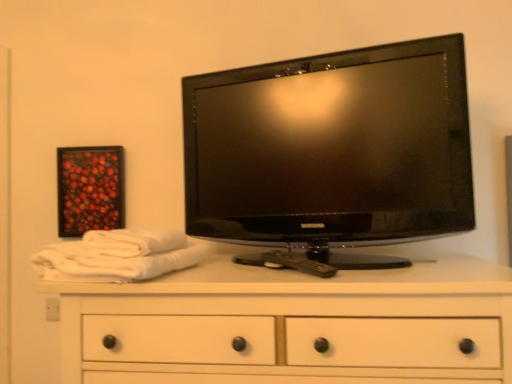
Question: Can we say white cotton bath towel at left, which is counted as the 2th bath towel, starting from the bottom, lies outside wooden framed artwork at upper left?

Choices:
 (A) yes
 (B) no

Answer: (A)

Question: Can you confirm if white cotton bath towel at left, which is counted as the 2th bath towel, starting from the bottom, is bigger than wooden framed artwork at upper left?

Choices:
 (A) no
 (B) yes

Answer: (B)

Question: Is white cotton bath towel at left, which is the first bath towel from top to bottom, aimed at wooden framed artwork at upper left?

Choices:
 (A) no
 (B) yes

Answer: (A)

Question: Can you confirm if white cotton bath towel at left, which is counted as the 2th bath towel, starting from the bottom, is positioned to the left of wooden framed artwork at upper left?

Choices:
 (A) yes
 (B) no

Answer: (B)

Question: Are white cotton bath towel at left, which is counted as the 2th bath towel, starting from the bottom, and wooden framed artwork at upper left located far from each other?

Choices:
 (A) no
 (B) yes

Answer: (A)

Question: Is white wood chest of drawers at center in front of or behind white cotton bath towel at left, marked as the 2th bath towel in a top-to-bottom arrangement, in the image?

Choices:
 (A) behind
 (B) front

Answer: (B)

Question: Is white wood chest of drawers at center wider or thinner than white cotton bath towel at left, marked as the 2th bath towel in a top-to-bottom arrangement?

Choices:
 (A) wide
 (B) thin

Answer: (A)

Question: From the image's perspective, relative to white cotton bath towel at left, the 1th bath towel positioned from the bottom, is white wood chest of drawers at center above or below?

Choices:
 (A) above
 (B) below

Answer: (B)

Question: From a real-world perspective, is white wood chest of drawers at center physically located above or below white cotton bath towel at left, the 1th bath towel positioned from the bottom?

Choices:
 (A) below
 (B) above

Answer: (A)

Question: Is wooden framed artwork at upper left situated inside white cotton bath towel at left, the 1th bath towel positioned from the bottom, or outside?

Choices:
 (A) outside
 (B) inside

Answer: (A)

Question: From their relative heights in the image, would you say wooden framed artwork at upper left is taller or shorter than white cotton bath towel at left, the 1th bath towel positioned from the bottom?

Choices:
 (A) tall
 (B) short

Answer: (A)

Question: From the image's perspective, relative to white cotton bath towel at left, the 1th bath towel positioned from the bottom, is wooden framed artwork at upper left above or below?

Choices:
 (A) below
 (B) above

Answer: (B)

Question: Is point (99, 226) positioned closer to the camera than point (117, 236)?

Choices:
 (A) closer
 (B) farther

Answer: (B)

Question: Looking at their shapes, would you say wooden framed artwork at upper left is wider or thinner than black glossy tv at upper center?

Choices:
 (A) wide
 (B) thin

Answer: (B)

Question: From a real-world perspective, relative to black glossy tv at upper center, is wooden framed artwork at upper left vertically above or below?

Choices:
 (A) above
 (B) below

Answer: (B)